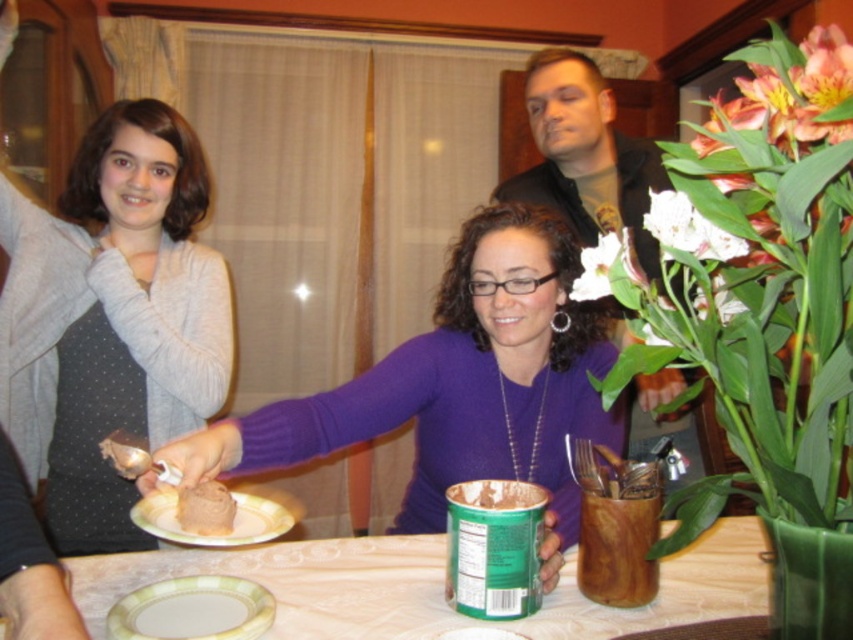
Is dark brown leather jacket at upper center thinner than porcelain plate at lower left?

In fact, dark brown leather jacket at upper center might be wider than porcelain plate at lower left.

Is dark brown leather jacket at upper center positioned at the back of porcelain plate at lower left?

Yes.

Which is in front, point (579, 168) or point (231, 596)?

Positioned in front is point (231, 596).

Locate an element on the screen. dark brown leather jacket at upper center is located at coordinates (585, 154).

Is dark brown leather jacket at upper center to the left of chocolate matte cake at center from the viewer's perspective?

Incorrect, dark brown leather jacket at upper center is not on the left side of chocolate matte cake at center.

Can you confirm if dark brown leather jacket at upper center is shorter than chocolate matte cake at center?

In fact, dark brown leather jacket at upper center may be taller than chocolate matte cake at center.

Who is more distant from viewer, (x=639, y=456) or (x=234, y=509)?

The point (x=639, y=456) is more distant.

Locate an element on the screen. The width and height of the screenshot is (853, 640). dark brown leather jacket at upper center is located at coordinates (585, 154).

Is purple matte sweater at center to the right of dark brown leather jacket at upper center from the viewer's perspective?

Incorrect, purple matte sweater at center is not on the right side of dark brown leather jacket at upper center.

Is purple matte sweater at center bigger than dark brown leather jacket at upper center?

Incorrect, purple matte sweater at center is not larger than dark brown leather jacket at upper center.

Is point (548, 362) positioned in front of point (538, 196)?

That is True.

The image size is (853, 640). Identify the location of purple matte sweater at center. (457, 381).